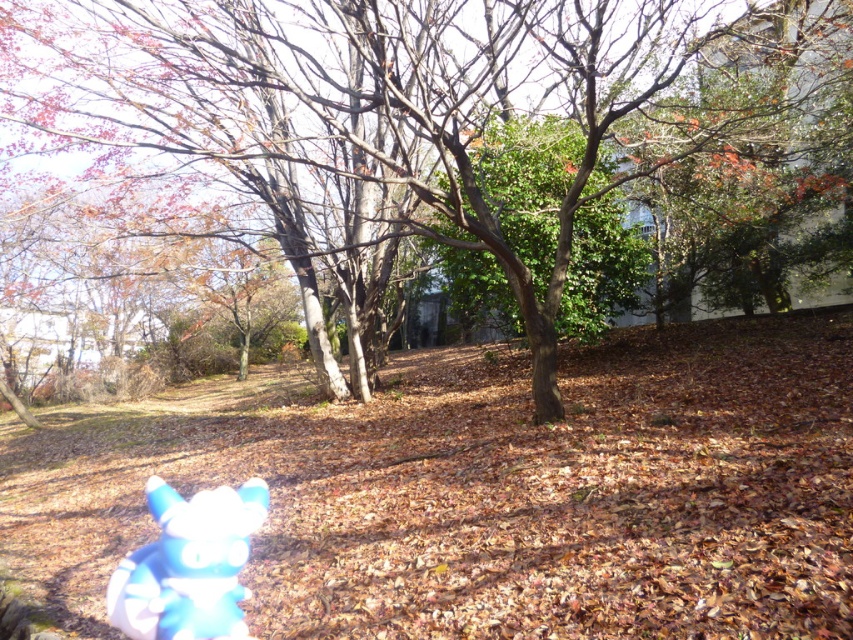
Locate an element on the screen. brown matte tree at center is located at coordinates (422, 108).

Does brown matte tree at center have a smaller size compared to blue plush toy at lower left?

No, brown matte tree at center is not smaller than blue plush toy at lower left.

The image size is (853, 640). What are the coordinates of `brown matte tree at center` in the screenshot? It's located at (422, 108).

Find the location of a particular element. This screenshot has height=640, width=853. brown matte tree at center is located at coordinates (422, 108).